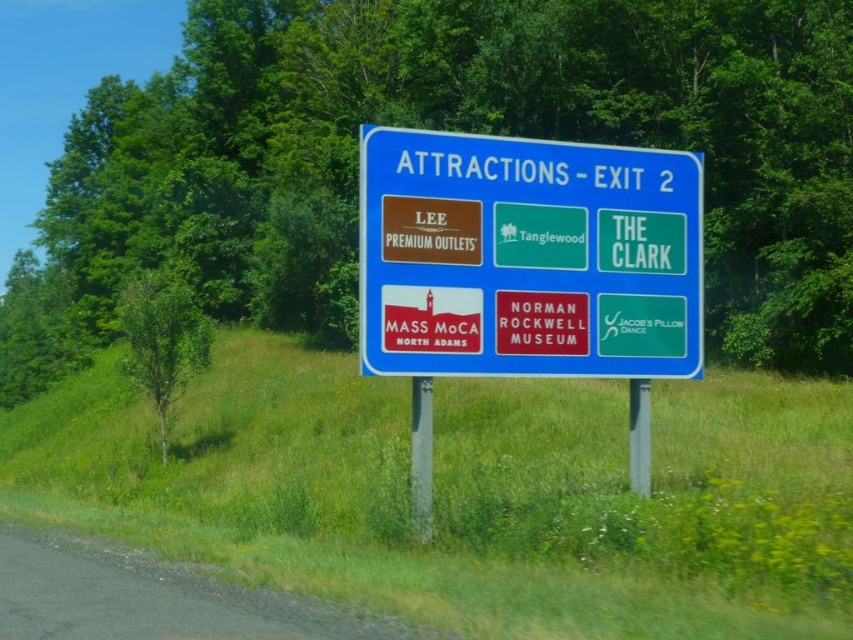
Who is taller, blue plastic sign at center or silver metallic pole at center?

With more height is blue plastic sign at center.

Who is positioned more to the right, blue plastic sign at center or silver metallic pole at center?

blue plastic sign at center

Image resolution: width=853 pixels, height=640 pixels. What are the coordinates of `blue plastic sign at center` in the screenshot? It's located at (527, 257).

Is the position of blue plastic sign at center more distant than that of metallic gray pole at center?

No, blue plastic sign at center is closer to the viewer.

Does blue plastic sign at center have a lesser width compared to metallic gray pole at center?

In fact, blue plastic sign at center might be wider than metallic gray pole at center.

Is point (550, 216) farther from camera compared to point (631, 388)?

That is False.

Locate an element on the screen. The width and height of the screenshot is (853, 640). blue plastic sign at center is located at coordinates (527, 257).

Does silver metallic pole at center have a greater width compared to metallic gray pole at center?

In fact, silver metallic pole at center might be narrower than metallic gray pole at center.

Describe the element at coordinates (421, 458) in the screenshot. The width and height of the screenshot is (853, 640). I see `silver metallic pole at center` at that location.

Which is behind, point (428, 500) or point (630, 412)?

The point (630, 412) is behind.

Locate an element on the screen. silver metallic pole at center is located at coordinates pos(421,458).